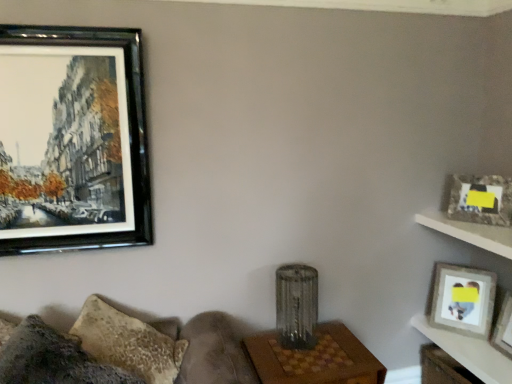
Locate an element on the screen. white wood shelf at upper right is located at coordinates (470, 232).

Locate an element on the screen. Image resolution: width=512 pixels, height=384 pixels. metallic textured lamp at center is located at coordinates (296, 305).

Describe the element at coordinates (296, 305) in the screenshot. I see `metallic textured lamp at center` at that location.

What is the approximate width of black glossy picture frame at upper left, which is the first picture frame in left-to-right order?

3.09 inches.

The image size is (512, 384). In order to click on black glossy picture frame at upper left, marked as the first picture frame in a top-to-bottom arrangement in this screenshot , I will do `click(72, 140)`.

This screenshot has width=512, height=384. Find the location of `wooden photo frame at upper right, the second picture frame in the left-to-right sequence`. wooden photo frame at upper right, the second picture frame in the left-to-right sequence is located at coordinates (462, 299).

Could you tell me if textured gray couch at lower left is turned towards matte gray picture frame at upper right, which is counted as the 2th picture frame, starting from the top?

No, textured gray couch at lower left is not facing towards matte gray picture frame at upper right, which is counted as the 2th picture frame, starting from the top.

Between textured gray couch at lower left and matte gray picture frame at upper right, arranged as the 3th picture frame when viewed from the left, which one has more height?

With more height is textured gray couch at lower left.

Looking at this image, is textured gray couch at lower left directly adjacent to matte gray picture frame at upper right, the 1th picture frame from the right?

textured gray couch at lower left and matte gray picture frame at upper right, the 1th picture frame from the right, are clearly separated.

Locate an element on the screen. This screenshot has width=512, height=384. picture frame in front of the wooden table at lower right, positioned as the 2th table in left-to-right order is located at coordinates (72, 140).

Looking at this image, between wooden table at lower right, positioned as the 2th table in left-to-right order, and black glossy picture frame at upper left, which is the 3th picture frame in bottom-to-top order, which one has smaller size?

wooden table at lower right, positioned as the 2th table in left-to-right order.

Is wooden table at lower right, which is the 1th table in right-to-left order, far from black glossy picture frame at upper left, which is the 3th picture frame in bottom-to-top order?

Yes, wooden table at lower right, which is the 1th table in right-to-left order, is far from black glossy picture frame at upper left, which is the 3th picture frame in bottom-to-top order.

Is wooden table at lower right, which is the 1th table in right-to-left order, at the left side of black glossy picture frame at upper left, which appears as the 3th picture frame when viewed from the right?

Incorrect, wooden table at lower right, which is the 1th table in right-to-left order, is not on the left side of black glossy picture frame at upper left, which appears as the 3th picture frame when viewed from the right.

Are textured gray couch at lower left and fuzzy fabric pillow at lower left beside each other?

Yes.

Considering the relative sizes of textured gray couch at lower left and fuzzy fabric pillow at lower left in the image provided, is textured gray couch at lower left wider than fuzzy fabric pillow at lower left?

No, textured gray couch at lower left is not wider than fuzzy fabric pillow at lower left.

From the image's perspective, is textured gray couch at lower left located beneath fuzzy fabric pillow at lower left?

Correct, textured gray couch at lower left appears lower than fuzzy fabric pillow at lower left in the image.

At what (x,y) coordinates should I click in order to perform the action: click on pillow above the textured gray couch at lower left (from the image's perspective). Please return your answer as a coordinate pair (x, y). The height and width of the screenshot is (384, 512). Looking at the image, I should click on (x=52, y=359).

From a real-world perspective, is wooden table at lower right, which is the 1th table in right-to-left order, located beneath matte gray picture frame at upper right, which is the second picture frame in bottom-to-top order?

Yes, from a real-world perspective, wooden table at lower right, which is the 1th table in right-to-left order, is beneath matte gray picture frame at upper right, which is the second picture frame in bottom-to-top order.

Is wooden table at lower right, positioned as the 2th table in left-to-right order, at the right side of matte gray picture frame at upper right, arranged as the 3th picture frame when viewed from the left?

Correct, you'll find wooden table at lower right, positioned as the 2th table in left-to-right order, to the right of matte gray picture frame at upper right, arranged as the 3th picture frame when viewed from the left.

Consider the image. Which object is further away from the camera, wooden table at lower right, positioned as the 2th table in left-to-right order, or matte gray picture frame at upper right, which is the second picture frame in bottom-to-top order?

matte gray picture frame at upper right, which is the second picture frame in bottom-to-top order.

Are wooden table at lower right, positioned as the 2th table in left-to-right order, and matte gray picture frame at upper right, which is the second picture frame in bottom-to-top order, far apart?

No, wooden table at lower right, positioned as the 2th table in left-to-right order, is not far away from matte gray picture frame at upper right, which is the second picture frame in bottom-to-top order.

Looking at this image, considering the sizes of objects matte gray picture frame at upper right, arranged as the 3th picture frame when viewed from the left, and black glossy picture frame at upper left, which is the first picture frame in left-to-right order, in the image provided, who is thinner, matte gray picture frame at upper right, arranged as the 3th picture frame when viewed from the left, or black glossy picture frame at upper left, which is the first picture frame in left-to-right order,?

With smaller width is black glossy picture frame at upper left, which is the first picture frame in left-to-right order.

Are matte gray picture frame at upper right, which is counted as the 2th picture frame, starting from the top, and black glossy picture frame at upper left, which is the first picture frame in left-to-right order, far apart?

Yes, matte gray picture frame at upper right, which is counted as the 2th picture frame, starting from the top, and black glossy picture frame at upper left, which is the first picture frame in left-to-right order, are located far from each other.

Is black glossy picture frame at upper left, which is the first picture frame in left-to-right order, at the back of matte gray picture frame at upper right, arranged as the 3th picture frame when viewed from the left?

matte gray picture frame at upper right, arranged as the 3th picture frame when viewed from the left, does not have its back to black glossy picture frame at upper left, which is the first picture frame in left-to-right order.

Would you say black glossy picture frame at upper left, marked as the first picture frame in a top-to-bottom arrangement, is outside wooden table at center, the 1th table viewed from the left?

Yes.

Is black glossy picture frame at upper left, which is the first picture frame in left-to-right order, oriented away from wooden table at center, the 1th table viewed from the left?

No, black glossy picture frame at upper left, which is the first picture frame in left-to-right order, is not facing away from wooden table at center, the 1th table viewed from the left.

Which object is closer to the camera taking this photo, black glossy picture frame at upper left, which appears as the 3th picture frame when viewed from the right, or wooden table at center, which is the 2th table from right to left?

black glossy picture frame at upper left, which appears as the 3th picture frame when viewed from the right.

In the scene shown: Which object is thinner, black glossy picture frame at upper left, which is the 3th picture frame in bottom-to-top order, or wooden table at center, which is the 2th table from right to left?

With smaller width is black glossy picture frame at upper left, which is the 3th picture frame in bottom-to-top order.

Based on their positions, is black glossy picture frame at upper left, marked as the first picture frame in a top-to-bottom arrangement, located to the left or right of wooden photo frame at upper right, the 2th picture frame positioned from the right?

Based on their positions, black glossy picture frame at upper left, marked as the first picture frame in a top-to-bottom arrangement, is located to the left of wooden photo frame at upper right, the 2th picture frame positioned from the right.

Is black glossy picture frame at upper left, marked as the first picture frame in a top-to-bottom arrangement, situated inside wooden photo frame at upper right, which is the third picture frame in top-to-bottom order, or outside?

black glossy picture frame at upper left, marked as the first picture frame in a top-to-bottom arrangement, cannot be found inside wooden photo frame at upper right, which is the third picture frame in top-to-bottom order.

Could you tell me if black glossy picture frame at upper left, which is the first picture frame in left-to-right order, is facing wooden photo frame at upper right, which is the third picture frame in top-to-bottom order?

No, black glossy picture frame at upper left, which is the first picture frame in left-to-right order, is not facing towards wooden photo frame at upper right, which is the third picture frame in top-to-bottom order.

Relative to wooden photo frame at upper right, which is counted as the first picture frame, starting from the bottom, is black glossy picture frame at upper left, which appears as the 3th picture frame when viewed from the right, in front or behind?

black glossy picture frame at upper left, which appears as the 3th picture frame when viewed from the right, is positioned closer to the viewer than wooden photo frame at upper right, which is counted as the first picture frame, starting from the bottom.

In order to click on couch directly beneath the matte gray picture frame at upper right, which is counted as the 2th picture frame, starting from the top (from a real-world perspective) in this screenshot , I will do `click(123, 351)`.

Identify the location of table that is the 2nd one when counting rightward from the black glossy picture frame at upper left, which is the 3th picture frame in bottom-to-top order. (468, 352).

Considering their positions, is fuzzy fabric pillow at lower left positioned closer to textured gray couch at lower left than black glossy picture frame at upper left, which is the 3th picture frame in bottom-to-top order?

Based on the image, fuzzy fabric pillow at lower left appears to be nearer to textured gray couch at lower left.

Looking at the image, which one is located closer to wooden table at lower right, which is the 1th table in right-to-left order, wooden photo frame at upper right, which is counted as the first picture frame, starting from the bottom, or fuzzy fabric pillow at lower left?

wooden photo frame at upper right, which is counted as the first picture frame, starting from the bottom, is positioned closer to the anchor wooden table at lower right, which is the 1th table in right-to-left order.

Which object lies further to the anchor point white wood shelf at upper right, black glossy picture frame at upper left, which is the first picture frame in left-to-right order, or textured gray couch at lower left?

black glossy picture frame at upper left, which is the first picture frame in left-to-right order, is further to white wood shelf at upper right.

From the picture: Considering their positions, is wooden table at lower right, which is the 1th table in right-to-left order, positioned closer to textured gray couch at lower left than black glossy picture frame at upper left, which appears as the 3th picture frame when viewed from the right?

Based on the image, black glossy picture frame at upper left, which appears as the 3th picture frame when viewed from the right, appears to be nearer to textured gray couch at lower left.

When comparing their distances from black glossy picture frame at upper left, marked as the first picture frame in a top-to-bottom arrangement, does textured gray couch at lower left or wooden table at center, which is the 2th table from right to left, seem further?

The object further to black glossy picture frame at upper left, marked as the first picture frame in a top-to-bottom arrangement, is wooden table at center, which is the 2th table from right to left.

From the image, which object appears to be farther from black glossy picture frame at upper left, which is the first picture frame in left-to-right order, matte gray picture frame at upper right, the 1th picture frame from the right, or fuzzy fabric pillow at lower left?

matte gray picture frame at upper right, the 1th picture frame from the right, is positioned further to the anchor black glossy picture frame at upper left, which is the first picture frame in left-to-right order.

Based on their spatial positions, is wooden table at lower right, which is the 1th table in right-to-left order, or matte gray picture frame at upper right, arranged as the 3th picture frame when viewed from the left, further from black glossy picture frame at upper left, which appears as the 3th picture frame when viewed from the right?

Based on the image, wooden table at lower right, which is the 1th table in right-to-left order, appears to be further to black glossy picture frame at upper left, which appears as the 3th picture frame when viewed from the right.

Looking at the image, which one is located further to matte gray picture frame at upper right, the 1th picture frame from the right, wooden table at lower right, positioned as the 2th table in left-to-right order, or fuzzy fabric pillow at lower left?

fuzzy fabric pillow at lower left lies further to matte gray picture frame at upper right, the 1th picture frame from the right, than the other object.

Where is `table located between textured gray couch at lower left and wooden table at lower right, positioned as the 2th table in left-to-right order, in the left-right direction`? table located between textured gray couch at lower left and wooden table at lower right, positioned as the 2th table in left-to-right order, in the left-right direction is located at coordinates (315, 359).

You are a GUI agent. You are given a task and a screenshot of the screen. Output one action in this format:
    pyautogui.click(x=<x>, y=<y>)
    Task: Click on the lamp between black glossy picture frame at upper left, marked as the first picture frame in a top-to-bottom arrangement, and matte gray picture frame at upper right, which is counted as the 2th picture frame, starting from the top
    
    Given the screenshot: What is the action you would take?
    pyautogui.click(x=296, y=305)

This screenshot has height=384, width=512. In order to click on lamp between black glossy picture frame at upper left, which is the 3th picture frame in bottom-to-top order, and wooden photo frame at upper right, which is counted as the first picture frame, starting from the bottom in this screenshot , I will do `click(296, 305)`.

Locate an element on the screen. This screenshot has height=384, width=512. pillow between black glossy picture frame at upper left, marked as the first picture frame in a top-to-bottom arrangement, and metallic textured lamp at center, in the horizontal direction is located at coordinates (52, 359).